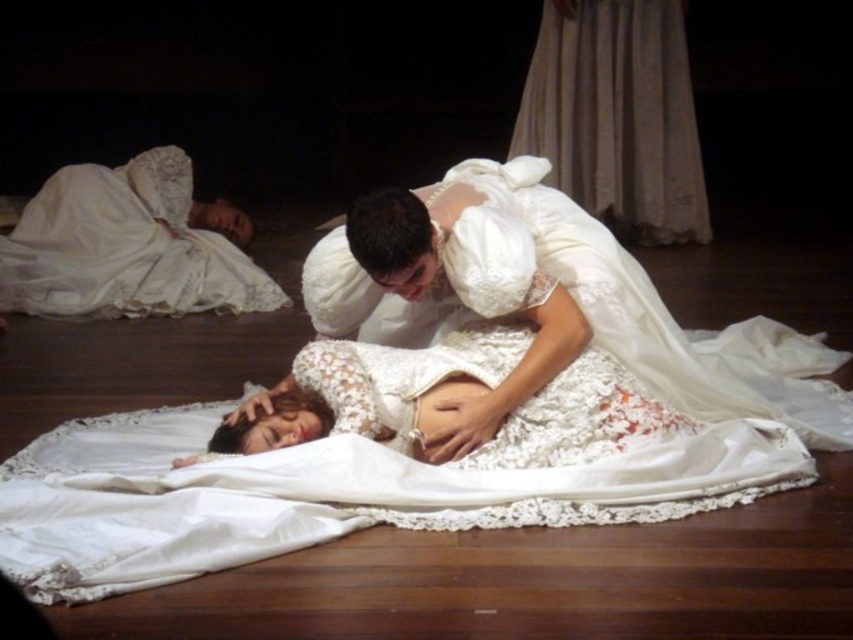
Is point (480, 301) less distant than point (460, 374)?

Yes, point (480, 301) is closer to viewer.

Does white lace gown at center have a greater height compared to smooth white belly at center?

Indeed, white lace gown at center has a greater height compared to smooth white belly at center.

Locate an element on the screen. white lace gown at center is located at coordinates (573, 300).

Is white lace dress at upper left to the right of smooth white belly at center from the viewer's perspective?

Incorrect, white lace dress at upper left is not on the right side of smooth white belly at center.

Which is in front, point (190, 276) or point (437, 387)?

Point (437, 387) is in front.

Identify the location of white lace dress at upper left. (125, 248).

What do you see at coordinates (573, 300) in the screenshot? I see `white lace gown at center` at bounding box center [573, 300].

Is white lace gown at center taller than white lace dress at upper left?

No, white lace gown at center is not taller than white lace dress at upper left.

Is point (469, 273) farther from viewer compared to point (213, 266)?

No, it is in front of (213, 266).

Image resolution: width=853 pixels, height=640 pixels. Find the location of `white lace gown at center`. white lace gown at center is located at coordinates (573, 300).